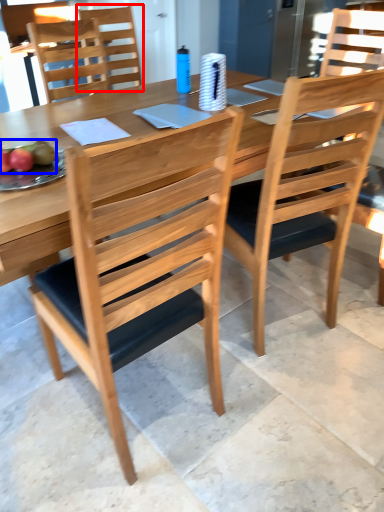
Question: Among these objects, which one is nearest to the camera, chair (highlighted by a red box) or fruit (highlighted by a blue box)?

Choices:
 (A) chair
 (B) fruit

Answer: (B)